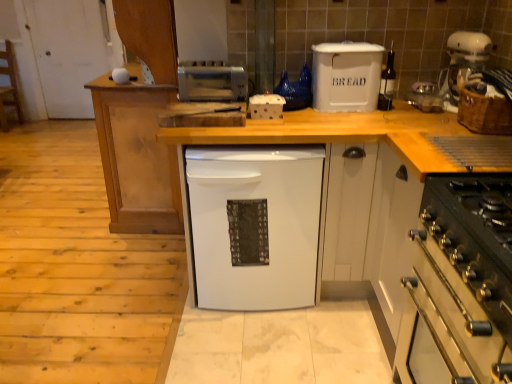
Where is `vacant region to the right of white plastic container at center, positioned as the 3th appliance in right-to-left order`? The image size is (512, 384). vacant region to the right of white plastic container at center, positioned as the 3th appliance in right-to-left order is located at coordinates (303, 120).